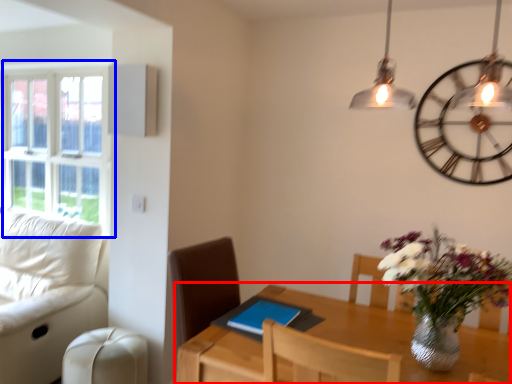
Question: Which point is further to the camera, table (highlighted by a red box) or window (highlighted by a blue box)?

Choices:
 (A) table
 (B) window

Answer: (B)